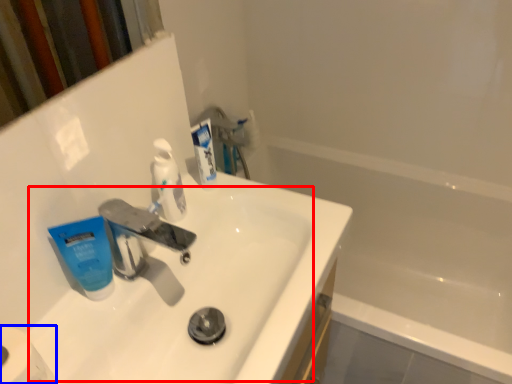
Question: Which object is further to the camera taking this photo, sink (highlighted by a red box) or toilet paper (highlighted by a blue box)?

Choices:
 (A) sink
 (B) toilet paper

Answer: (A)